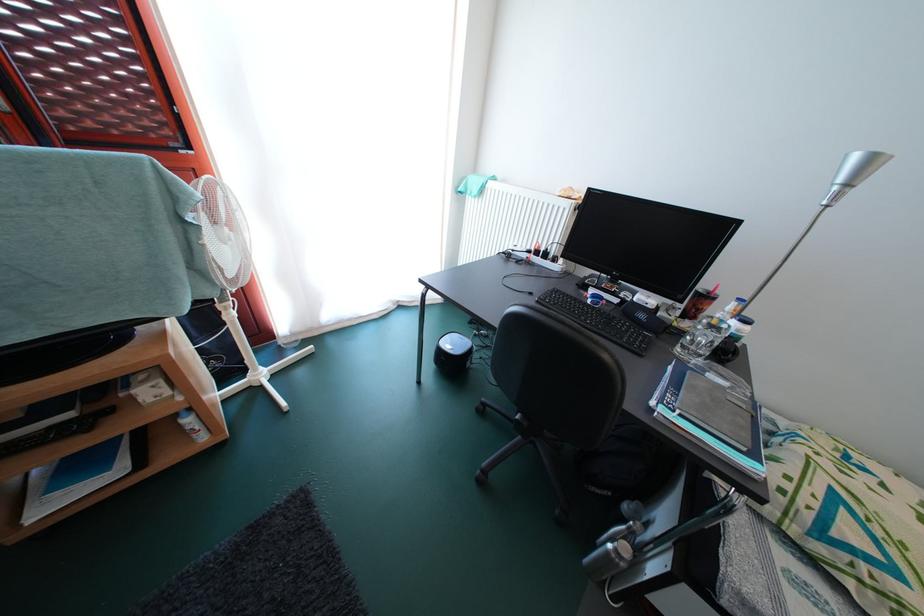
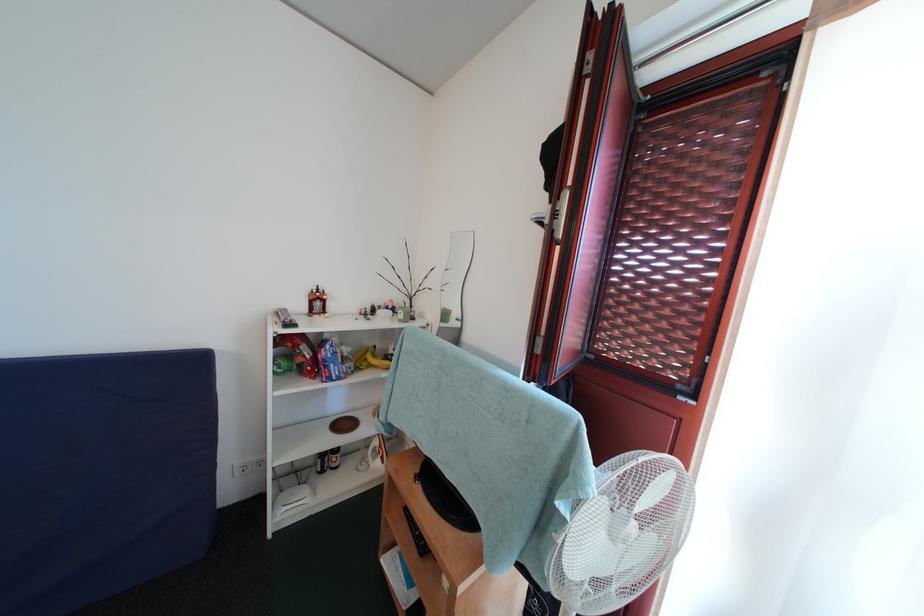
Question: Based on the continuous images, in which direction is the camera rotating? Reply with the corresponding letter.

Choices:
 (A) Left
 (B) Right
 (C) Up
 (D) Down

Answer: (A)